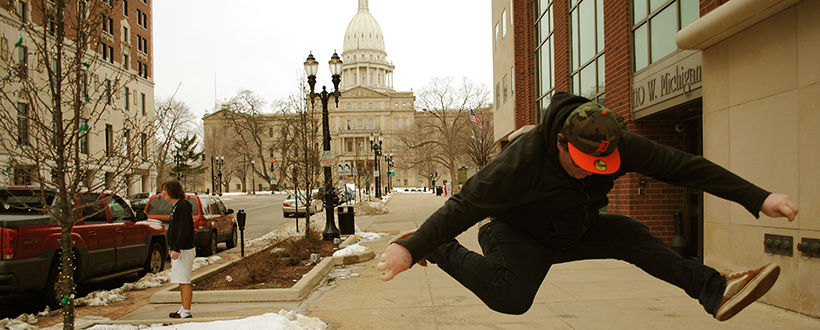
Where is `hood`? The width and height of the screenshot is (820, 330). hood is located at coordinates pos(549,129).